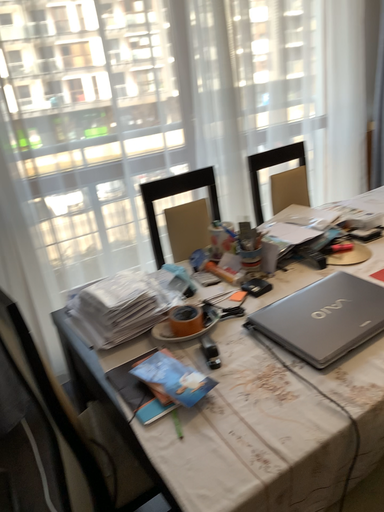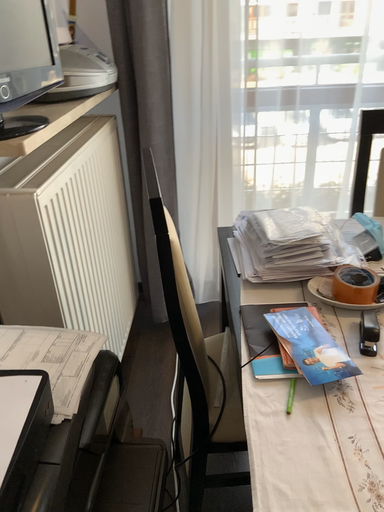
Question: How did the camera likely rotate when shooting the video?

Choices:
 (A) rotated right
 (B) rotated left

Answer: (B)